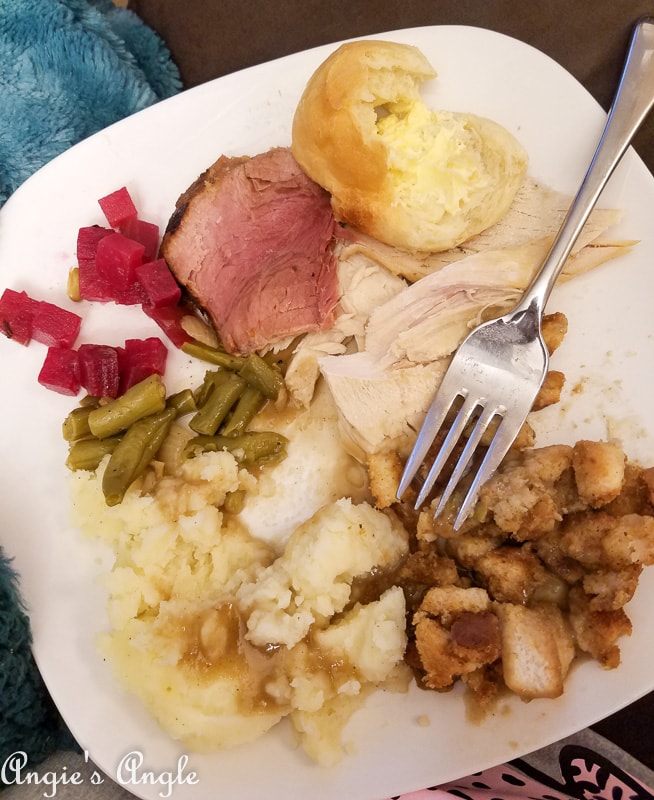
Where is `plate`? Image resolution: width=654 pixels, height=800 pixels. plate is located at coordinates (44, 454).